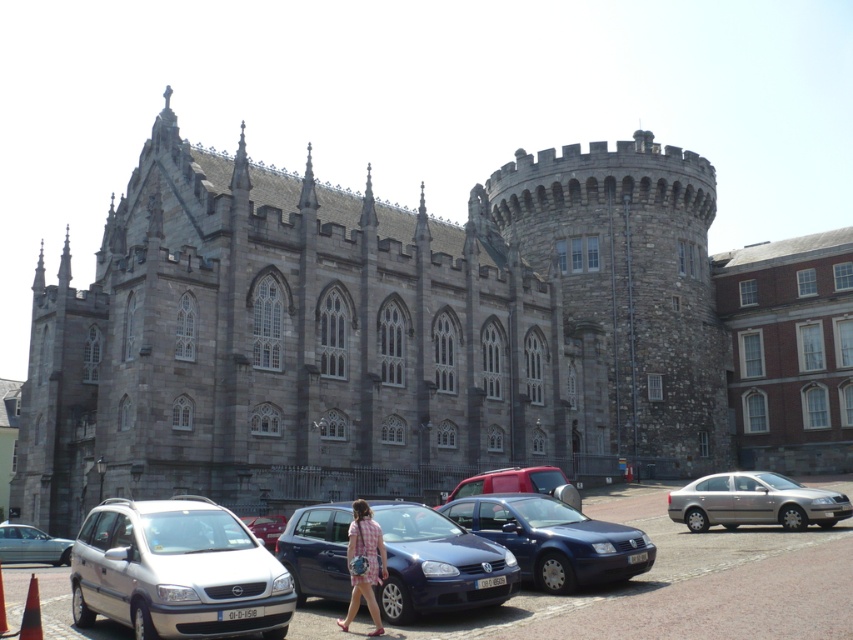
Can you confirm if silver metallic sedan at right is wider than pink plaid dress at center?

Correct, the width of silver metallic sedan at right exceeds that of pink plaid dress at center.

Between silver metallic sedan at right and pink plaid dress at center, which one is positioned lower?

silver metallic sedan at right is lower down.

From the picture: Who is more distant from viewer, (764, 486) or (352, 545)?

The point (764, 486) is behind.

Image resolution: width=853 pixels, height=640 pixels. I want to click on silver metallic sedan at right, so click(755, 500).

Which is more to the right, silver metallic sedan at right or matte red car at center?

silver metallic sedan at right is more to the right.

Can you confirm if silver metallic sedan at right is smaller than matte red car at center?

Incorrect, silver metallic sedan at right is not smaller in size than matte red car at center.

Locate an element on the screen. The image size is (853, 640). silver metallic sedan at right is located at coordinates (755, 500).

Who is positioned more to the right, matte blue car at center or silver metallic sedan at lower left?

matte blue car at center is more to the right.

From the picture: Is matte blue car at center below silver metallic sedan at lower left?

Incorrect, matte blue car at center is not positioned below silver metallic sedan at lower left.

Between point (421, 564) and point (13, 560), which one is positioned behind?

Positioned behind is point (13, 560).

At what (x,y) coordinates should I click in order to perform the action: click on matte blue car at center. Please return your answer as a coordinate pair (x, y). This screenshot has height=640, width=853. Looking at the image, I should click on (437, 564).